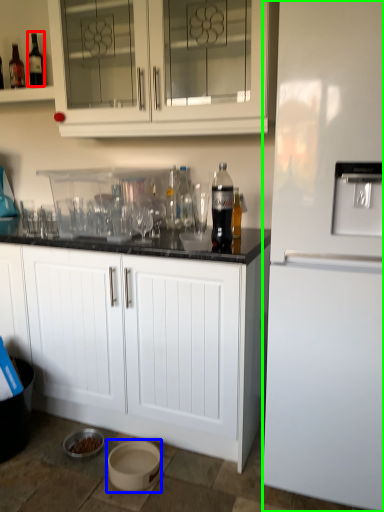
Question: Which is farther away from drinking straw (highlighted by a red box)? basin (highlighted by a blue box) or refrigerator (highlighted by a green box)?

Choices:
 (A) basin
 (B) refrigerator

Answer: (A)